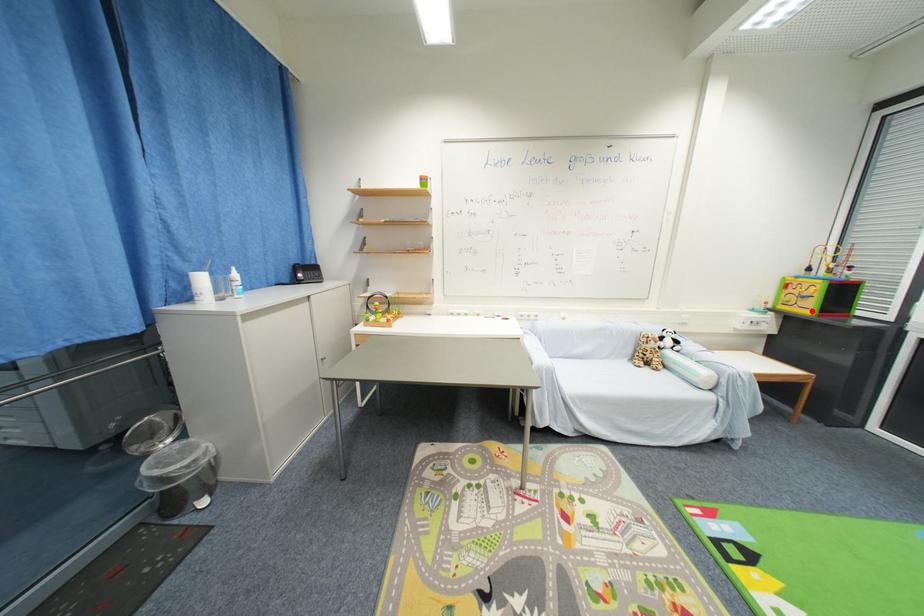
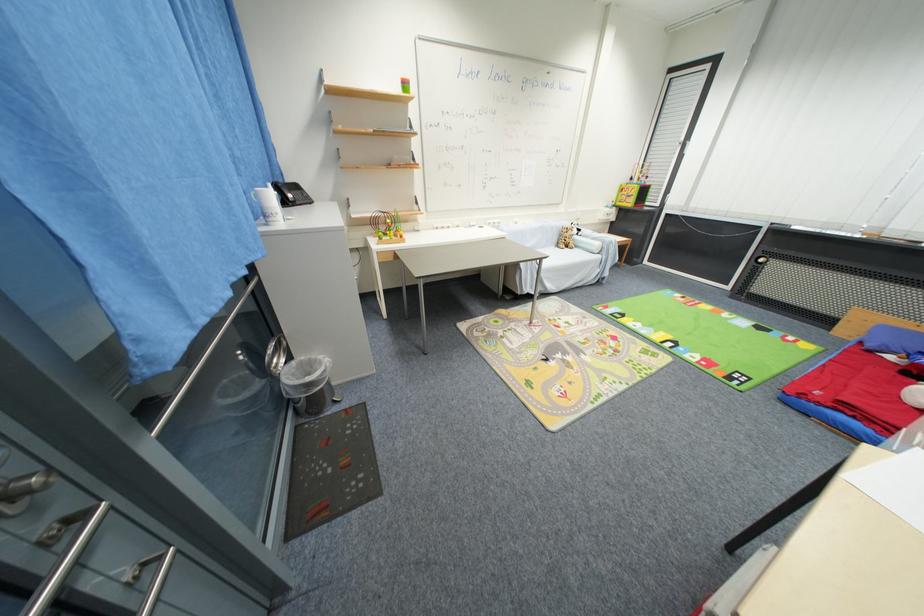
Question: I am providing you with two images of the same scene from different viewpoints. A red point is marked on the first image. Is the red point's position out of view in image 2?

Choices:
 (A) Yes
 (B) No

Answer: (B)